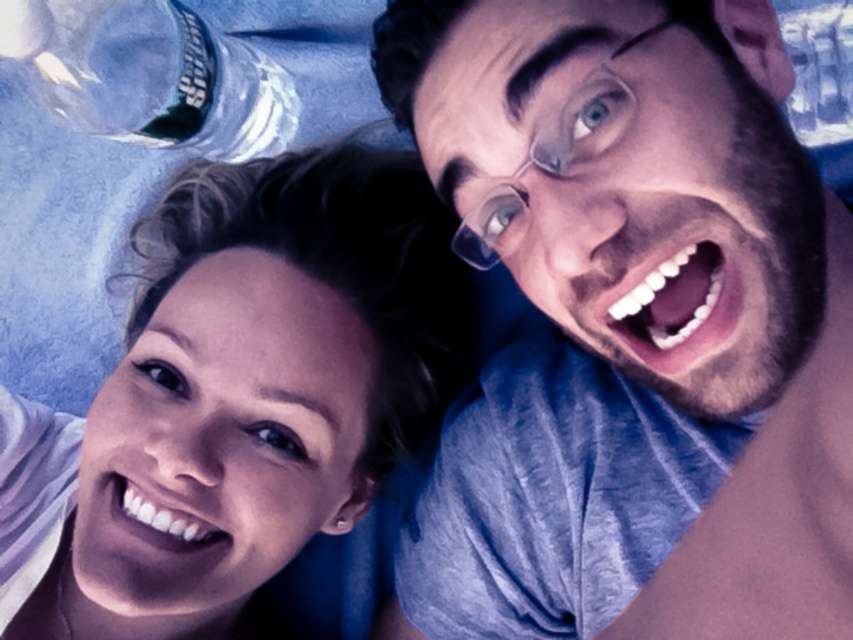
Question: Among these objects, which one is nearest to the camera?

Choices:
 (A) clear plastic bottle at upper left
 (B) matte blue shirt at upper right
 (C) clear plastic glasses at upper center

Answer: (B)

Question: Is matte blue shirt at upper right smaller than clear plastic bottle at upper left?

Choices:
 (A) yes
 (B) no

Answer: (B)

Question: Is matte blue shirt at upper right smaller than clear plastic glasses at upper center?

Choices:
 (A) yes
 (B) no

Answer: (B)

Question: Which object is the closest to the clear plastic bottle at upper left?

Choices:
 (A) matte blue shirt at upper right
 (B) clear plastic glasses at upper center
 (C) matte white face at center

Answer: (C)

Question: Does clear plastic bottle at upper left lie in front of clear plastic glasses at upper center?

Choices:
 (A) no
 (B) yes

Answer: (A)

Question: Considering the real-world distances, which object is closest to the matte blue shirt at upper right?

Choices:
 (A) clear plastic glasses at upper center
 (B) clear plastic bottle at upper left

Answer: (A)